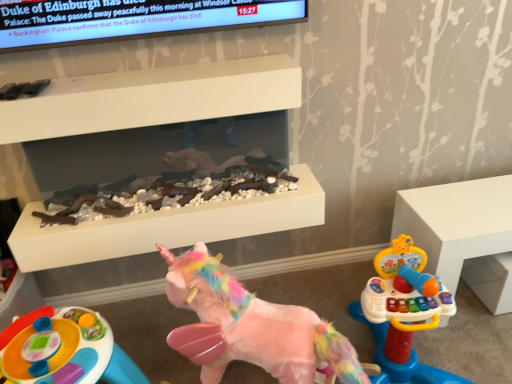
Question: Do you think plastic colorful activity table at lower left, the 2th toy when ordered from right to left, is within white matte fireplace at upper center, or outside of it?

Choices:
 (A) outside
 (B) inside

Answer: (A)

Question: Considering the positions of plastic colorful activity table at lower left, the first toy positioned from the left, and white matte fireplace at upper center in the image, is plastic colorful activity table at lower left, the first toy positioned from the left, wider or thinner than white matte fireplace at upper center?

Choices:
 (A) thin
 (B) wide

Answer: (B)

Question: Estimate the real-world distances between objects in this image. Which object is farther from the white matte fireplace at upper center?

Choices:
 (A) white plastic toy at right
 (B) fluffy pink unicorn at center, which is the 1th toy from right to left
 (C) plastic colorful activity table at lower left, the 2th toy when ordered from right to left

Answer: (A)

Question: Based on their relative distances, which object is nearer to the white plastic toy at right?

Choices:
 (A) plastic colorful activity table at lower left, the first toy positioned from the left
 (B) fluffy pink unicorn at center, positioned as the 2th toy in left-to-right order
 (C) white matte fireplace at upper center

Answer: (C)